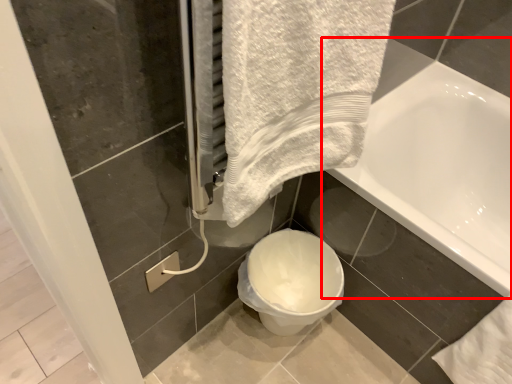
Question: From the image's perspective, what is the correct spatial relationship of bathtub (annotated by the red box) in relation to toilet?

Choices:
 (A) below
 (B) above

Answer: (B)